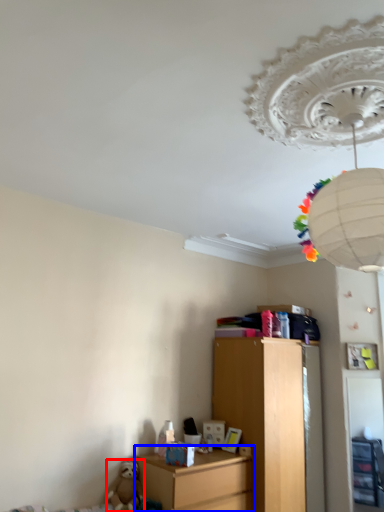
Question: Which object appears closest to the camera in this image, toy (highlighted by a red box) or nightstand (highlighted by a blue box)?

Choices:
 (A) toy
 (B) nightstand

Answer: (B)